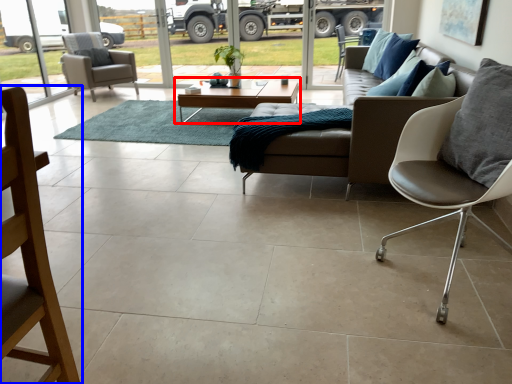
Question: Which of the following is the farthest to the observer, coffee table (highlighted by a red box) or chair (highlighted by a blue box)?

Choices:
 (A) coffee table
 (B) chair

Answer: (A)